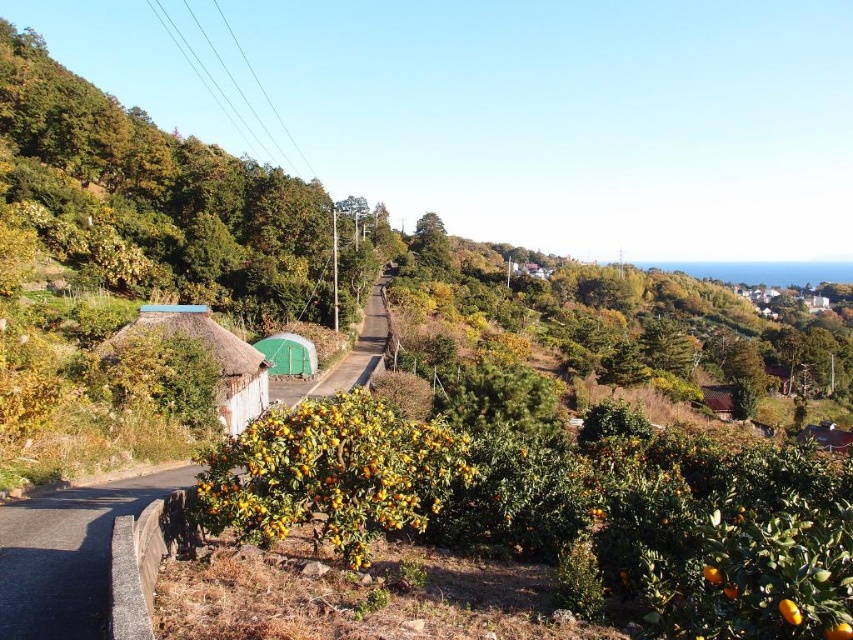
You are standing at the center of the road in the rural landscape. There are two points marked on the image. The first point is at coordinates point (225, 417) and the second is at point (724, 410). If you were to walk towards the first point, would you be moving towards the citrus trees or the thatched roof structure?

The point (225, 417) is in front of point (724, 410). Since the citrus trees are in the foreground, walking towards the first point would lead you toward the citrus trees.

You are a traveler who needs to decide which of the two huts to approach for shelter. The green thatched roof hut at center and the brown thatched hut at upper right are both options. Based on their sizes, which one would you choose if you prefer a larger space?

The brown thatched hut at upper right is larger in size compared to the green thatched roof hut at center, so it would be the better choice for a larger shelter.

You are a tourist standing on the paved road in the middle of the scene. You want to take a photo that includes both the green thatched roof hut at center and the brown thatched hut at upper right. Which direction should you face to ensure both huts are visible in the frame?

The green thatched roof hut at center is positioned over the brown thatched hut at upper right, so you should face upward to include both huts in your photo.